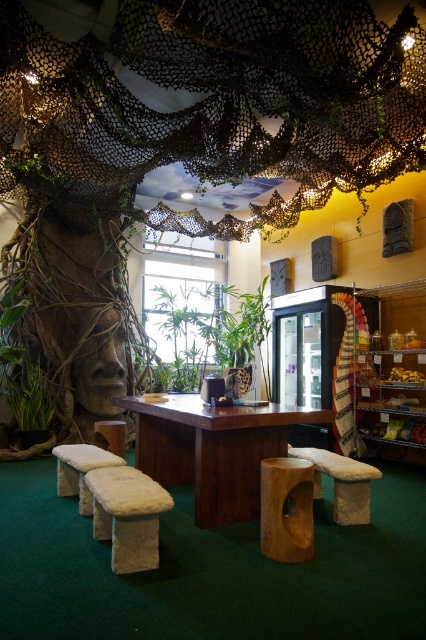
You are standing in the tropical themed indoor space and want to move from the wooden table to the shelving unit. Which point, point (278,38) or point (112,566), is closer to you as you walk towards the shelving unit?

Point (278,38) is closer to you because it is further to the viewer than point (112,566), meaning it is physically nearer in the space as you move forward.

You are organizing a small event and need to place a decorative item that requires a wider base. You have a brown textured tree trunk at center and a white fur stool at center available. Which object should you choose to ensure stability?

The brown textured tree trunk at center has a larger width than the white fur stool at center, making it more stable for holding the decorative item.